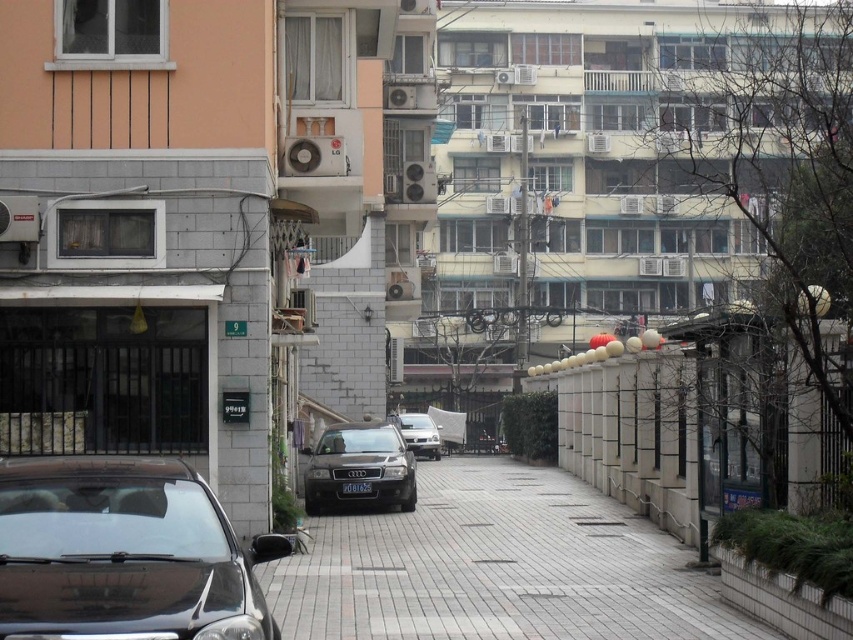
From the picture: Which of these two, sleek silver sedan at center or black plastic license plate at center, stands shorter?

With less height is black plastic license plate at center.

What do you see at coordinates (421, 435) in the screenshot? I see `sleek silver sedan at center` at bounding box center [421, 435].

Image resolution: width=853 pixels, height=640 pixels. I want to click on sleek silver sedan at center, so click(421, 435).

Is point (376, 426) positioned behind point (345, 488)?

Yes, point (376, 426) is farther from viewer.

In the scene shown: Between satin gold car at center and black plastic license plate at center, which one is positioned higher?

satin gold car at center is higher up.

This screenshot has height=640, width=853. Find the location of `satin gold car at center`. satin gold car at center is located at coordinates (358, 467).

In the scene shown: Can you confirm if gray brick pavement at center is bigger than sleek silver sedan at center?

Indeed, gray brick pavement at center has a larger size compared to sleek silver sedan at center.

Based on the photo, is gray brick pavement at center above sleek silver sedan at center?

Yes.

Between point (596, 586) and point (439, 449), which one is positioned in front?

Point (596, 586) is more forward.

Locate an element on the screen. This screenshot has width=853, height=640. gray brick pavement at center is located at coordinates (497, 566).